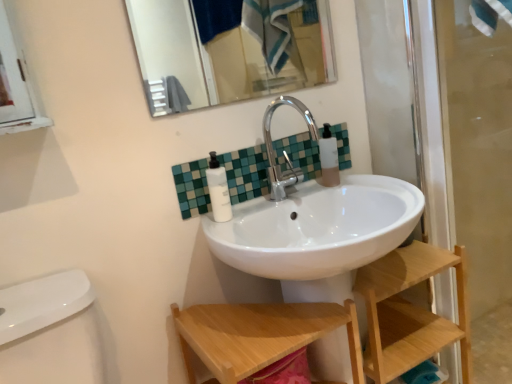
I want to click on vacant area that is situated to the right of silver metallic faucet at center, so click(x=368, y=185).